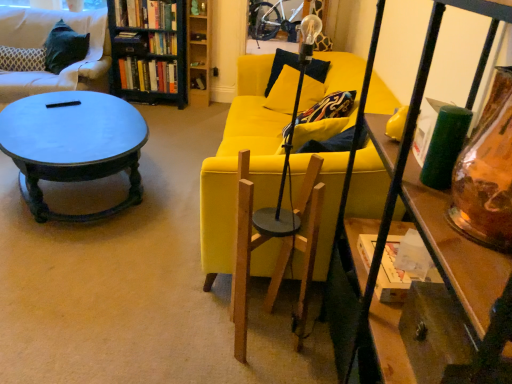
Locate an element on the screen. This screenshot has width=512, height=384. vacant area that is in front of matte dark blue coffee table at left is located at coordinates (88, 277).